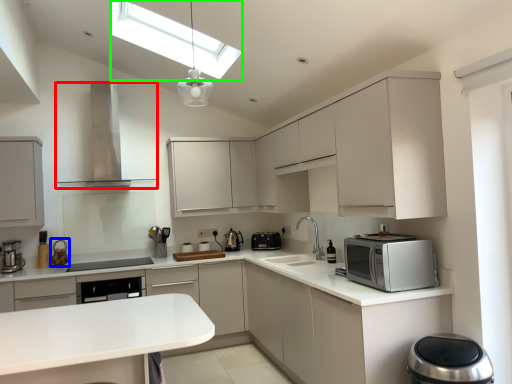
Question: Which object is the closest to the home appliance (highlighted by a red box)? Choose among these: appliance (highlighted by a blue box) or lighting (highlighted by a green box).

Choices:
 (A) appliance
 (B) lighting

Answer: (B)